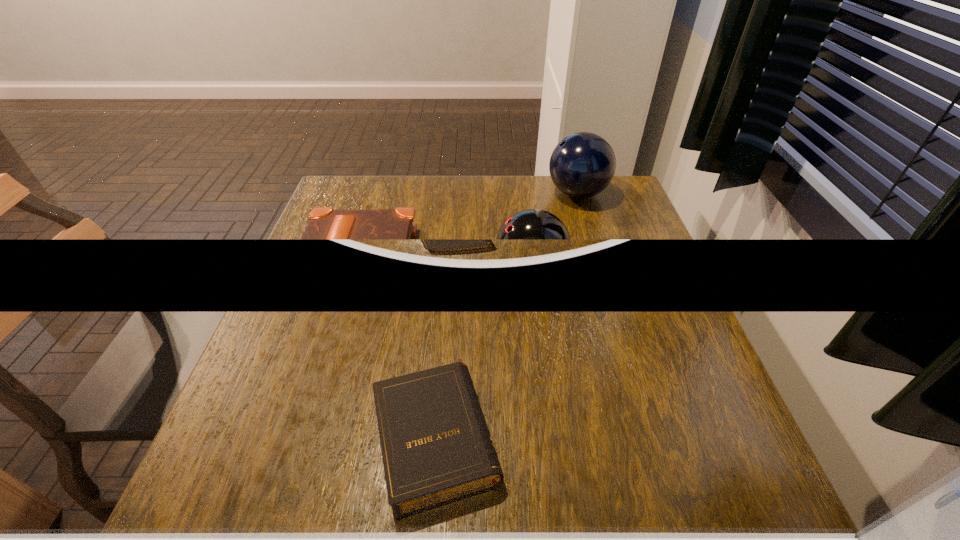
Locate an element on the screen. This screenshot has height=540, width=960. blank space located 0.180m on the spine side of the leftmost object is located at coordinates (339, 350).

At what (x,y) coordinates should I click in order to perform the action: click on object situated at the far edge. Please return your answer as a coordinate pair (x, y). The height and width of the screenshot is (540, 960). Looking at the image, I should click on (582, 165).

I want to click on object positioned at the left edge, so click(324, 222).

Image resolution: width=960 pixels, height=540 pixels. Identify the location of object present at the right edge. (582, 165).

The image size is (960, 540). What are the coordinates of `object that is at the far right corner` in the screenshot? It's located at (582, 165).

This screenshot has width=960, height=540. What are the coordinates of `vacant position at the far edge of the desktop` in the screenshot? It's located at (558, 197).

Where is `blank space at the near edge of the desktop`? The image size is (960, 540). blank space at the near edge of the desktop is located at coordinates (389, 519).

The height and width of the screenshot is (540, 960). In the image, there is a desktop. In order to click on vacant space at the left edge in this screenshot , I will do `click(228, 441)`.

Where is `vacant space at the right edge`? This screenshot has height=540, width=960. vacant space at the right edge is located at coordinates (704, 369).

Locate an element on the screen. Image resolution: width=960 pixels, height=540 pixels. free space at the near left corner is located at coordinates (275, 511).